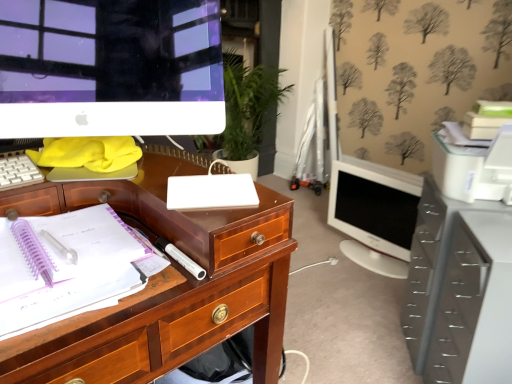
Find the location of `free space above white glossy monitor at center right, the 1th computer monitor from the back (from a real-world perspective)`. free space above white glossy monitor at center right, the 1th computer monitor from the back (from a real-world perspective) is located at coordinates (367, 170).